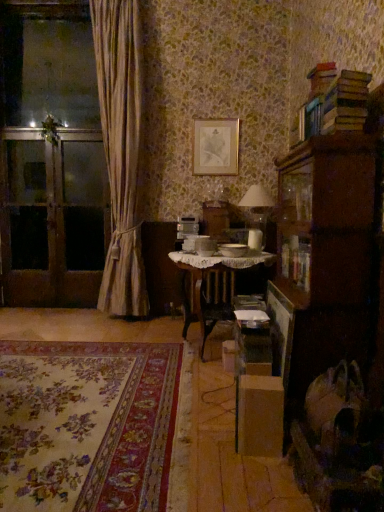
What are the coordinates of `silky beige curtain at left` in the screenshot? It's located at (121, 151).

This screenshot has height=512, width=384. What are the coordinates of `white matte table lamp at center` in the screenshot? It's located at (256, 208).

Is there a large distance between velvet dark brown swivel chair at lower right and floral carpet at lower left?

No, velvet dark brown swivel chair at lower right is in close proximity to floral carpet at lower left.

Between point (354, 508) and point (68, 350), which one is positioned behind?

The point (68, 350) is farther.

From the picture: Considering the relative positions of velvet dark brown swivel chair at lower right and floral carpet at lower left in the image provided, is velvet dark brown swivel chair at lower right behind floral carpet at lower left?

No, it is not.

This screenshot has height=512, width=384. I want to click on pattern behind the velvet dark brown swivel chair at lower right, so (x=87, y=425).

In terms of width, does gold metallic picture frame at upper center look wider or thinner when compared to silky beige curtain at left?

Clearly, gold metallic picture frame at upper center has less width compared to silky beige curtain at left.

Is there a large distance between gold metallic picture frame at upper center and silky beige curtain at left?

No, there isn't a large distance between gold metallic picture frame at upper center and silky beige curtain at left.

Can you confirm if gold metallic picture frame at upper center is bigger than silky beige curtain at left?

Actually, gold metallic picture frame at upper center might be smaller than silky beige curtain at left.

Looking at this image, is silky beige curtain at left at the back of gold metallic picture frame at upper center?

No, silky beige curtain at left is not at the back of gold metallic picture frame at upper center.

Are hardcover books at upper right and gold metallic picture frame at upper center far apart?

hardcover books at upper right is far away from gold metallic picture frame at upper center.

Is hardcover books at upper right to the left of gold metallic picture frame at upper center from the viewer's perspective?

No, hardcover books at upper right is not to the left of gold metallic picture frame at upper center.

Which is nearer, (336,120) or (195,120)?

Result: Point (336,120) is closer to the camera than point (195,120).

Is hardcover books at upper right taller than gold metallic picture frame at upper center?

No, hardcover books at upper right is not taller than gold metallic picture frame at upper center.

Where is `table lamp below the gold metallic picture frame at upper center (from a real-world perspective)`? The width and height of the screenshot is (384, 512). table lamp below the gold metallic picture frame at upper center (from a real-world perspective) is located at coordinates (256, 208).

Is white matte table lamp at center to the right of gold metallic picture frame at upper center from the viewer's perspective?

Yes.

From a real-world perspective, is white matte table lamp at center positioned above or below gold metallic picture frame at upper center?

From a real-world perspective, white matte table lamp at center is physically below gold metallic picture frame at upper center.

Is white matte table lamp at center not within gold metallic picture frame at upper center?

Yes, white matte table lamp at center is not within gold metallic picture frame at upper center.

Could you tell me if wooden cabinet at right is facing velvet dark brown swivel chair at lower right?

No, wooden cabinet at right does not turn towards velvet dark brown swivel chair at lower right.

In terms of width, does wooden cabinet at right look wider or thinner when compared to velvet dark brown swivel chair at lower right?

In the image, wooden cabinet at right appears to be more narrow than velvet dark brown swivel chair at lower right.

Is point (284, 220) closer to camera compared to point (333, 390)?

No.

Considering the sizes of wooden cabinet at right and velvet dark brown swivel chair at lower right in the image, is wooden cabinet at right bigger or smaller than velvet dark brown swivel chair at lower right?

Considering their sizes, wooden cabinet at right takes up more space than velvet dark brown swivel chair at lower right.

From the image's perspective, is wooden cabinet at right above or below hardcover books at upper right?

Based on their image positions, wooden cabinet at right is located beneath hardcover books at upper right.

Is the depth of wooden cabinet at right less than that of hardcover books at upper right?

No, wooden cabinet at right is further to the viewer.

Is wooden cabinet at right situated inside hardcover books at upper right or outside?

wooden cabinet at right is outside hardcover books at upper right.

Is wooden cabinet at right bigger than hardcover books at upper right?

Correct, wooden cabinet at right is larger in size than hardcover books at upper right.

Is velvet dark brown swivel chair at lower right inside or outside of transparent glass screen door at left, which appears as the first screen door when viewed from the right?

The correct answer is: outside.

How many degrees apart are the facing directions of velvet dark brown swivel chair at lower right and transparent glass screen door at left, which appears as the first screen door when viewed from the right?

The facing directions of velvet dark brown swivel chair at lower right and transparent glass screen door at left, which appears as the first screen door when viewed from the right, are 90.9 degrees apart.

Is velvet dark brown swivel chair at lower right oriented away from transparent glass screen door at left, which is the 3th screen door from left to right?

No.

Is velvet dark brown swivel chair at lower right taller than transparent glass screen door at left, which is the 3th screen door from left to right?

In fact, velvet dark brown swivel chair at lower right may be shorter than transparent glass screen door at left, which is the 3th screen door from left to right.

Identify the location of swivel chair on the right of floral carpet at lower left. (340, 444).

In the image, there is a silky beige curtain at left. At what (x,y) coordinates should I click in order to perform the action: click on picture frame above it (from the image's perspective). Please return your answer as a coordinate pair (x, y). The height and width of the screenshot is (512, 384). Looking at the image, I should click on (215, 147).

In the scene shown: Considering their positions, is transparent glass screen door at left, positioned as the 2th screen door in left-to-right order, positioned further to brown wooden screen door at left, the 1th screen door from the left, than white matte table lamp at center?

white matte table lamp at center lies further to brown wooden screen door at left, the 1th screen door from the left, than the other object.

When comparing their distances from white matte table lamp at center, does silky beige curtain at left or transparent glass screen door at left, arranged as the second screen door when viewed from the right, seem further?

transparent glass screen door at left, arranged as the second screen door when viewed from the right, lies further to white matte table lamp at center than the other object.

Based on their spatial positions, is silky beige curtain at left or hardcover books at upper right closer to transparent glass screen door at left, positioned as the 2th screen door in left-to-right order?

silky beige curtain at left lies closer to transparent glass screen door at left, positioned as the 2th screen door in left-to-right order, than the other object.

Based on their spatial positions, is white lace-covered table at center or velvet dark brown swivel chair at lower right further from wooden cabinet at right?

The object further to wooden cabinet at right is white lace-covered table at center.

Estimate the real-world distances between objects in this image. Which object is closer to white lace-covered table at center, white matte table lamp at center or silky beige curtain at left?

white matte table lamp at center.

Based on their spatial positions, is hardcover books at upper right or transparent glass screen door at left, arranged as the second screen door when viewed from the right, closer to gold metallic picture frame at upper center?

transparent glass screen door at left, arranged as the second screen door when viewed from the right, lies closer to gold metallic picture frame at upper center than the other object.

Estimate the real-world distances between objects in this image. Which object is further from silky beige curtain at left, white matte table lamp at center or floral carpet at lower left?

Based on the image, floral carpet at lower left appears to be further to silky beige curtain at left.

When comparing their distances from gold metallic picture frame at upper center, does hardcover books at upper right or white lace-covered table at center seem further?

hardcover books at upper right.

The height and width of the screenshot is (512, 384). I want to click on book located between velvet dark brown swivel chair at lower right and gold metallic picture frame at upper center in the depth direction, so click(x=334, y=101).

At what (x,y) coordinates should I click in order to perform the action: click on cabinetry between velvet dark brown swivel chair at lower right and transparent glass screen door at left, positioned as the 2th screen door in left-to-right order, in the front-back direction. Please return your answer as a coordinate pair (x, y). This screenshot has width=384, height=512. Looking at the image, I should click on (323, 261).

Locate an element on the screen. curtain between floral carpet at lower left and gold metallic picture frame at upper center from front to back is located at coordinates (121, 151).

Find the location of a particular element. picture frame positioned between floral carpet at lower left and brown wooden screen door at left, positioned as the 3th screen door in right-to-left order, from near to far is located at coordinates click(215, 147).